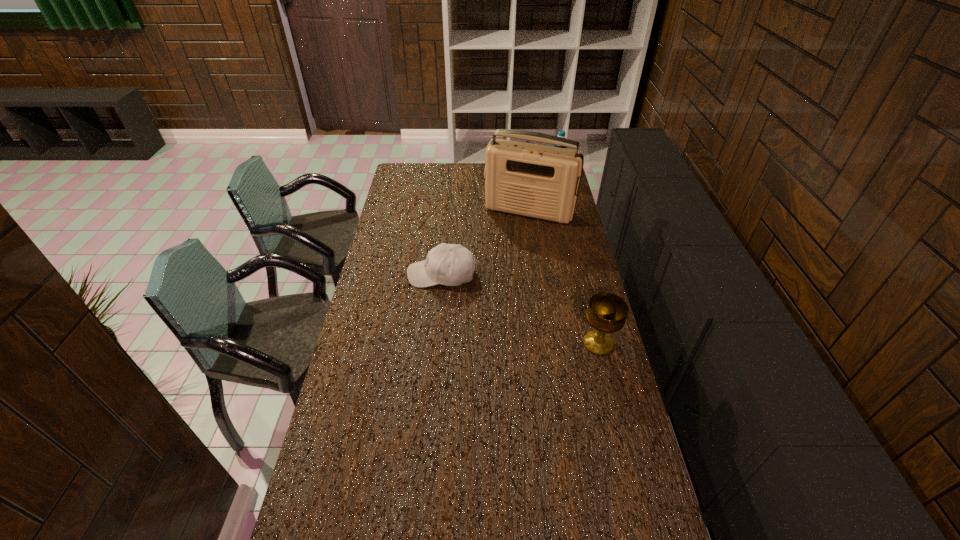
Image resolution: width=960 pixels, height=540 pixels. I want to click on free space between the farthest object and the leftmost object, so click(x=499, y=225).

The width and height of the screenshot is (960, 540). In order to click on free point between the leftmost object and the chalice in this screenshot , I will do `click(520, 309)`.

Identify the location of free spot between the chalice and the radio receiver. Image resolution: width=960 pixels, height=540 pixels. (564, 277).

The image size is (960, 540). Find the location of `free space between the baseball cap and the second farthest object`. free space between the baseball cap and the second farthest object is located at coordinates (486, 243).

At what (x,y) coordinates should I click in order to perform the action: click on empty space between the tallest object and the shortest object. Please return your answer as a coordinate pair (x, y). This screenshot has width=960, height=540. Looking at the image, I should click on (486, 243).

Locate which object is the second closest to the nearest object. Please provide its 2D coordinates. Your answer should be formatted as a tuple, i.e. [(x, y)], where the tuple contains the x and y coordinates of a point satisfying the conditions above.

[(532, 180)]

Identify which object is located as the nearest to the leftmost object. Please provide its 2D coordinates. Your answer should be formatted as a tuple, i.e. [(x, y)], where the tuple contains the x and y coordinates of a point satisfying the conditions above.

[(532, 180)]

Find the location of a particular element. Image resolution: width=960 pixels, height=540 pixels. vacant space that satisfies the following two spatial constraints: 1. on the back side of the farthest object; 2. on the left side of the third nearest object is located at coordinates (524, 176).

Identify the location of blank area in the image that satisfies the following two spatial constraints: 1. on the front side of the tallest object; 2. on the right side of the chalice. (548, 343).